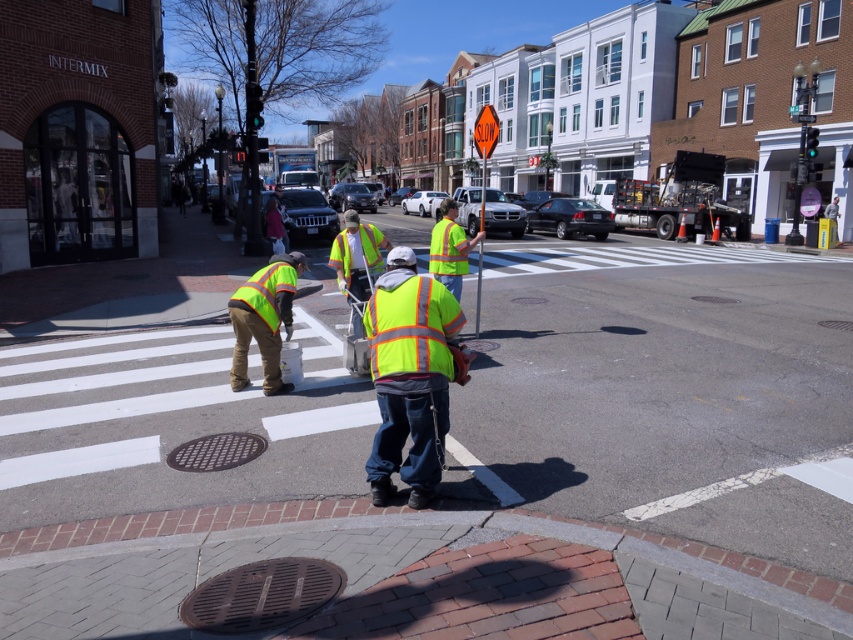
Question: Which of these objects is positioned farthest from the orange reflective plastic at upper center?

Choices:
 (A) yellow reflective safety vest at center
 (B) high-visibility fabric safety vest at center
 (C) high-visibility reflective vest at center

Answer: (A)

Question: Is brown textured manhole cover at lower center smaller than high-visibility fabric safety vest at center?

Choices:
 (A) yes
 (B) no

Answer: (A)

Question: Is high-visibility reflective vest at center wider than high-visibility fabric safety vest at center?

Choices:
 (A) no
 (B) yes

Answer: (B)

Question: Observing the image, what is the correct spatial positioning of high-visibility fabric safety vest at center in reference to yellow reflective safety vest at center?

Choices:
 (A) below
 (B) above

Answer: (B)

Question: Which is nearer to the high-visibility fabric safety vest at center?

Choices:
 (A) yellow reflective safety vest at center
 (B) high-visibility reflective vest at center
 (C) high-visibility fabric safety vest at lower left
 (D) orange reflective plastic at upper center

Answer: (A)

Question: Among these objects, which one is nearest to the camera?

Choices:
 (A) high-visibility fabric safety vest at lower left
 (B) high-visibility reflective vest at center

Answer: (B)